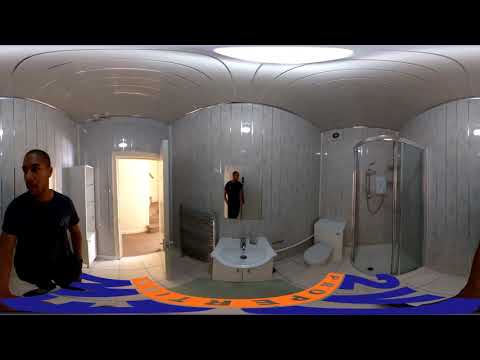
The height and width of the screenshot is (360, 480). Identify the location of toilet. (319, 252).